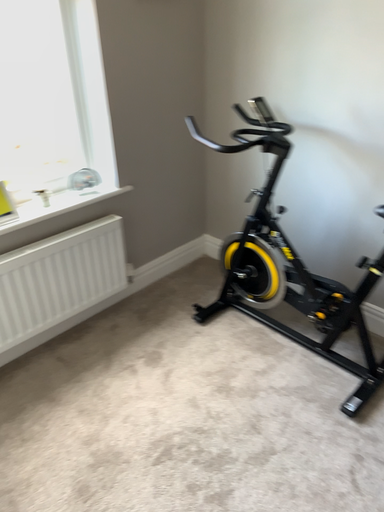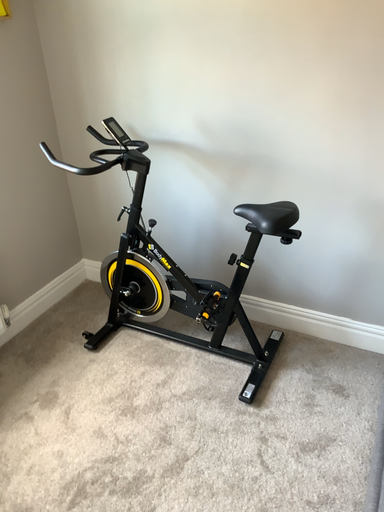
Question: Which way did the camera rotate in the video?

Choices:
 (A) rotated right
 (B) rotated left

Answer: (A)